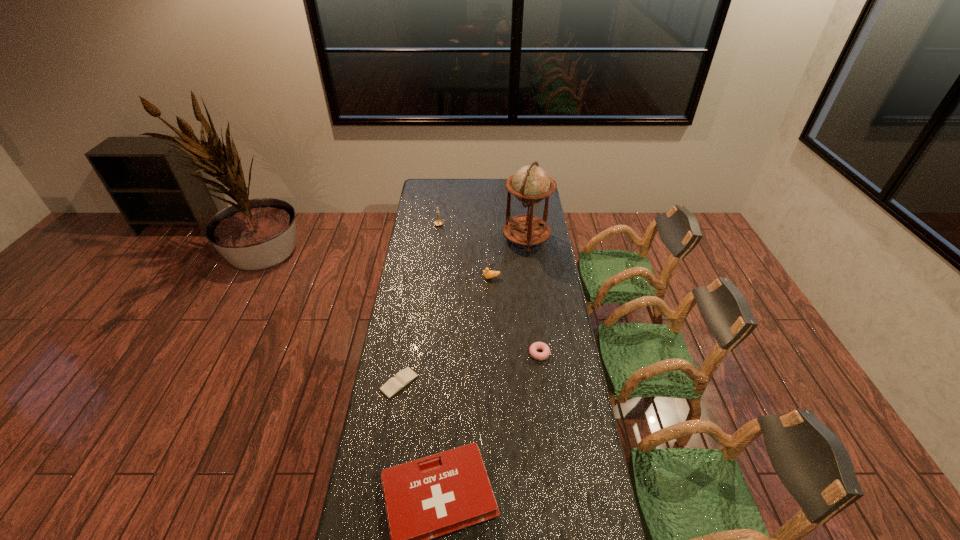
Identify the location of blank area at the far edge. The height and width of the screenshot is (540, 960). (459, 198).

Find the location of a particular element. The image size is (960, 540). vacant space at the left edge of the desktop is located at coordinates (419, 332).

The width and height of the screenshot is (960, 540). I want to click on vacant area at the right edge of the desktop, so point(585,414).

Identify the location of free space that is in between the tallest object and the fourth nearest object. (509, 259).

Locate an element on the screen. The height and width of the screenshot is (540, 960). free space between the diary and the third farthest object is located at coordinates (445, 330).

Locate an element on the screen. The image size is (960, 540). free space that is in between the tallest object and the diary is located at coordinates (463, 311).

The height and width of the screenshot is (540, 960). In order to click on object that is the third closest one to the second tallest object in this screenshot , I will do `click(544, 347)`.

Choose which object is the third nearest neighbor to the first-aid kit. Please provide its 2D coordinates. Your answer should be formatted as a tuple, i.e. [(x, y)], where the tuple contains the x and y coordinates of a point satisfying the conditions above.

[(487, 274)]

Locate an element on the screen. Image resolution: width=960 pixels, height=540 pixels. free space that satisfies the following two spatial constraints: 1. on the handle side of the doughnut; 2. on the right side of the second tallest object is located at coordinates (425, 354).